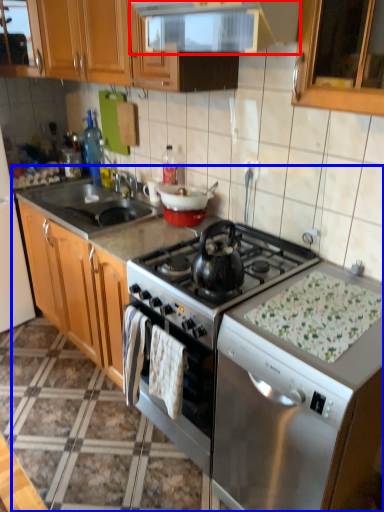
Question: Which point is further to the camera, kitchen appliance (highlighted by a red box) or countertop (highlighted by a blue box)?

Choices:
 (A) kitchen appliance
 (B) countertop

Answer: (B)